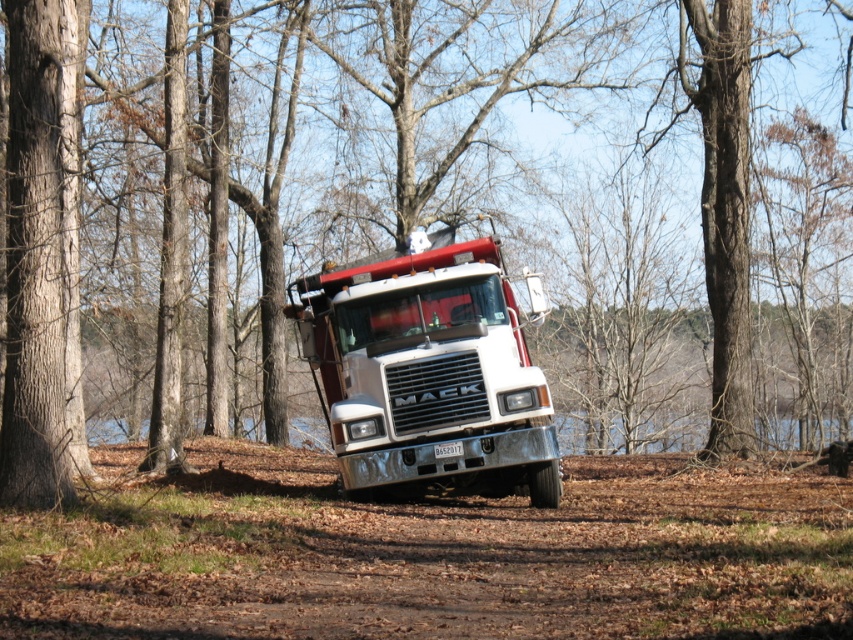
You are navigating a large Mack truck and need to stay on the brown dirt track at center. Based on the truck size and the track location, can you confirm if the truck will fit on the track?

The brown dirt track at center is located at point (x=436, y=556), so the truck should fit as long as the track width at that coordinate is sufficient for the truck.

You are a delivery driver who needs to turn around your vehicle on the dirt track. Based on the scene, can you determine if the white metallic truck at center has enough space to maneuver on the brown dirt track at center?

The brown dirt track at center is located below the white metallic truck at center. Since the truck is parked on the track, there should be sufficient space for it to maneuver as long as the track itself is wide enough. However, the description does not provide specific measurements about the track width, so we cannot confirm definitively. The answer would depend on typical dirt track widths for vehicle maneuvering.

You are driving a white metallic truck at center on a brown dirt track at center. Can the truck stay entirely on the track without any part hanging off?

The brown dirt track at center is wider than the white metallic truck at center, so the truck can stay entirely on the track without any part hanging off.